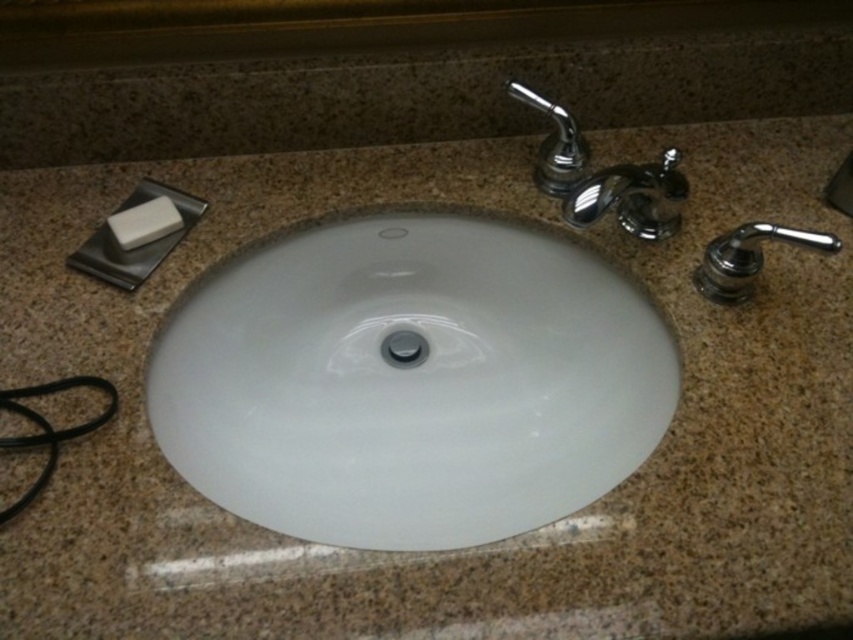
Question: Is white glossy sink at center to the right of white matte soap at upper left from the viewer's perspective?

Choices:
 (A) yes
 (B) no

Answer: (A)

Question: Is white glossy sink at center wider than polished chrome faucet at right?

Choices:
 (A) no
 (B) yes

Answer: (B)

Question: Does chrome metallic faucet at upper right appear on the right side of white matte soap at upper left?

Choices:
 (A) no
 (B) yes

Answer: (B)

Question: Estimate the real-world distances between objects in this image. Which object is closer to the polished chrome faucet at upper right?

Choices:
 (A) white glossy sink at center
 (B) white matte soap at upper left

Answer: (A)

Question: Which point is closer to the camera?

Choices:
 (A) white glossy sink at center
 (B) chrome metallic faucet at upper right
 (C) polished chrome faucet at upper right
 (D) white matte soap at upper left

Answer: (A)

Question: Which point appears closest to the camera in this image?

Choices:
 (A) (642, 188)
 (B) (558, 132)
 (C) (564, 401)

Answer: (A)